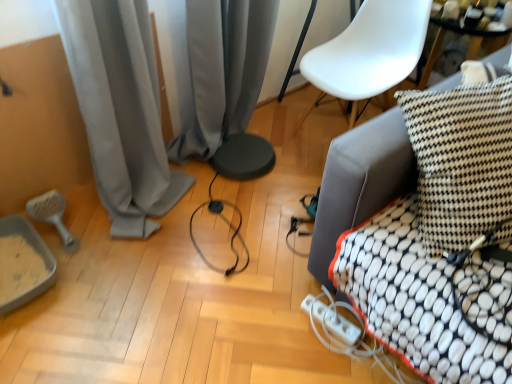
Identify the location of free spot in front of white plastic extension cord at lower center. point(330,359).